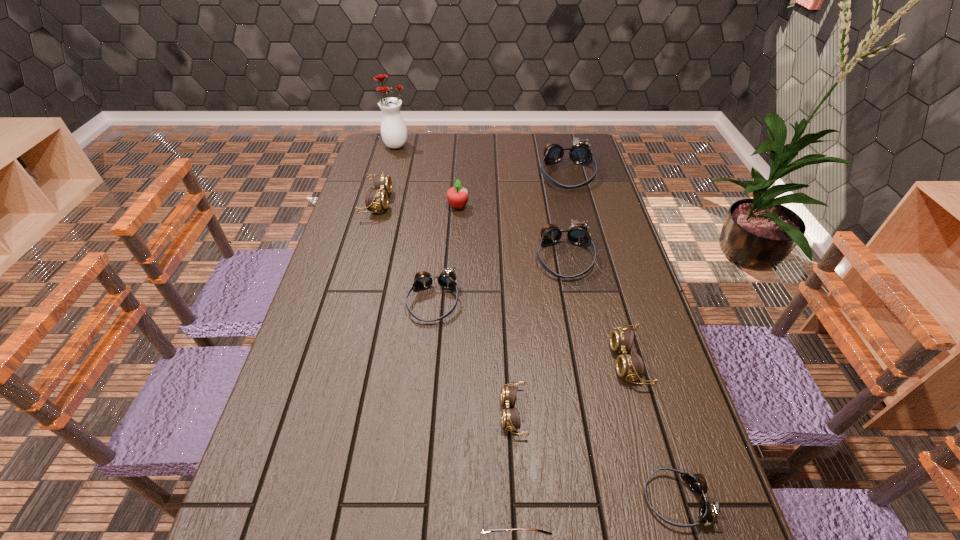
This screenshot has height=540, width=960. Find the location of `vacant region located through the lenses of the second smallest brown goggles`. vacant region located through the lenses of the second smallest brown goggles is located at coordinates (580, 361).

Locate an element on the screen. The width and height of the screenshot is (960, 540). vacant area located through the lenses of the second smallest brown goggles is located at coordinates (575, 361).

I want to click on free location located 0.260m through the lenses of the third biggest bronze goggles, so click(x=421, y=417).

Where is `vacant region located through the lenses of the smallest brown goggles`? The width and height of the screenshot is (960, 540). vacant region located through the lenses of the smallest brown goggles is located at coordinates (433, 413).

The width and height of the screenshot is (960, 540). Identify the location of blank space located 0.070m through the lenses of the smallest brown goggles. [469, 413].

Identify the location of free region located 0.120m through the lenses of the smallest brown goggles. This screenshot has width=960, height=540. 447,413.

Where is `vacant area situated through the lenses of the second nearest object`? vacant area situated through the lenses of the second nearest object is located at coordinates (562, 500).

I want to click on free space located through the lenses of the second nearest object, so click(x=526, y=500).

I want to click on vacant space located 0.180m through the lenses of the second nearest object, so click(x=551, y=500).

At what (x,y) coordinates should I click in order to perform the action: click on vase present at the far edge. Please return your answer as a coordinate pair (x, y). Image resolution: width=960 pixels, height=540 pixels. Looking at the image, I should click on (393, 129).